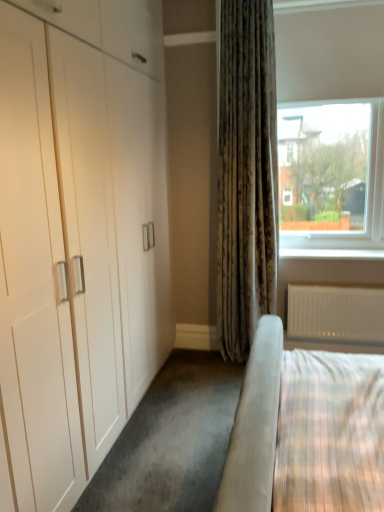
Question: Is clear glass window at upper right outside white textured radiator at lower right?

Choices:
 (A) no
 (B) yes

Answer: (B)

Question: Is clear glass window at upper right bigger than white textured radiator at lower right?

Choices:
 (A) yes
 (B) no

Answer: (A)

Question: Is there a large distance between clear glass window at upper right and white textured radiator at lower right?

Choices:
 (A) no
 (B) yes

Answer: (A)

Question: Could white textured radiator at lower right be considered to be inside clear glass window at upper right?

Choices:
 (A) no
 (B) yes

Answer: (A)

Question: Can you confirm if clear glass window at upper right is positioned to the left of white textured radiator at lower right?

Choices:
 (A) no
 (B) yes

Answer: (B)

Question: From the image's perspective, relative to white smooth window sill at lower right, is white textured radiator at lower right above or below?

Choices:
 (A) below
 (B) above

Answer: (A)

Question: Is white textured radiator at lower right to the left or to the right of white smooth window sill at lower right in the image?

Choices:
 (A) left
 (B) right

Answer: (B)

Question: In terms of width, does white textured radiator at lower right look wider or thinner when compared to white smooth window sill at lower right?

Choices:
 (A) thin
 (B) wide

Answer: (A)

Question: Relative to white smooth window sill at lower right, is white textured radiator at lower right in front or behind?

Choices:
 (A) front
 (B) behind

Answer: (A)

Question: Considering the positions of point (374, 248) and point (288, 188), is point (374, 248) closer or farther from the camera than point (288, 188)?

Choices:
 (A) farther
 (B) closer

Answer: (B)

Question: In terms of size, does white smooth window sill at lower right appear bigger or smaller than clear glass window at upper right?

Choices:
 (A) big
 (B) small

Answer: (B)

Question: Considering their positions, is white smooth window sill at lower right located in front of or behind clear glass window at upper right?

Choices:
 (A) front
 (B) behind

Answer: (B)

Question: Which is correct: white smooth window sill at lower right is inside clear glass window at upper right, or outside of it?

Choices:
 (A) inside
 (B) outside

Answer: (A)

Question: From a real-world perspective, is white smooth window sill at lower right above or below white textured radiator at lower right?

Choices:
 (A) above
 (B) below

Answer: (A)

Question: Would you say white smooth window sill at lower right is inside or outside white textured radiator at lower right?

Choices:
 (A) inside
 (B) outside

Answer: (B)